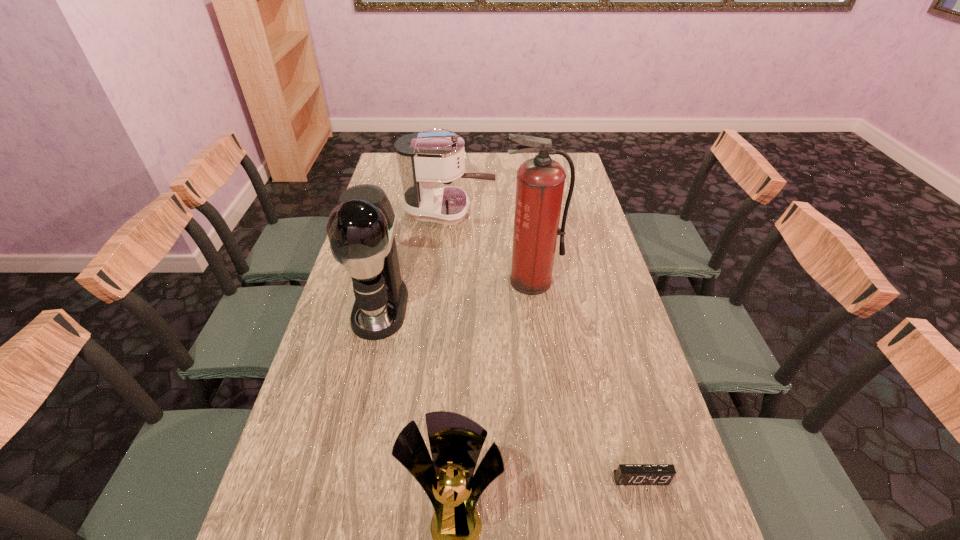
The image size is (960, 540). Identify the location of the tallest object. (540, 183).

I want to click on the fourth object from left to right, so click(540, 183).

Locate an element on the screen. This screenshot has width=960, height=540. the second tallest object is located at coordinates (361, 229).

Locate an element on the screen. the nearer coffee maker is located at coordinates (361, 229).

The width and height of the screenshot is (960, 540). I want to click on the shorter coffee maker, so tap(423, 159).

At what (x,y) coordinates should I click in order to perform the action: click on the farthest object. Please return your answer as a coordinate pair (x, y). Looking at the image, I should click on (423, 159).

Find the location of `the shortest object`. the shortest object is located at coordinates (626, 474).

Where is `alarm clock`? This screenshot has width=960, height=540. alarm clock is located at coordinates (626, 474).

Where is `vacant space located 0.120m at the nozzle of the fourth object from left to right`? vacant space located 0.120m at the nozzle of the fourth object from left to right is located at coordinates (538, 325).

Locate an element on the screen. vacant area situated place cup under the spout of the nearer coffee maker is located at coordinates [370, 355].